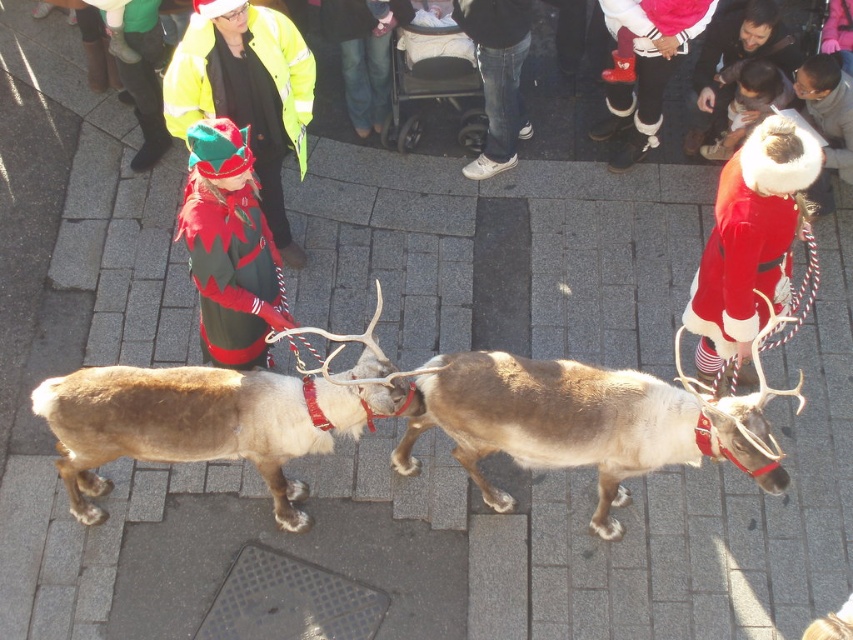
Does point (299, 72) lie behind point (233, 260)?

Yes.

Who is more forward, (267, 202) or (206, 326)?

Positioned in front is point (206, 326).

Describe the element at coordinates (247, 92) in the screenshot. The width and height of the screenshot is (853, 640). I see `shiny yellow jacket at upper left` at that location.

Find the location of a particular element. This screenshot has width=853, height=640. shiny yellow jacket at upper left is located at coordinates (247, 92).

Does brown fuzzy reindeer at center lie behind velvet red coat at upper right?

No, it is not.

Is brown fuzzy reindeer at center wider than velvet red coat at upper right?

Indeed, brown fuzzy reindeer at center has a greater width compared to velvet red coat at upper right.

Is point (74, 499) behind point (781, 246)?

Yes, it is.

The image size is (853, 640). I want to click on brown fuzzy reindeer at center, so click(x=215, y=417).

Does brown fur reindeer at center have a larger size compared to brown fuzzy reindeer at center?

Actually, brown fur reindeer at center might be smaller than brown fuzzy reindeer at center.

Who is more distant from viewer, (628, 467) or (65, 381)?

The point (628, 467) is behind.

This screenshot has width=853, height=640. I want to click on brown fur reindeer at center, so click(589, 422).